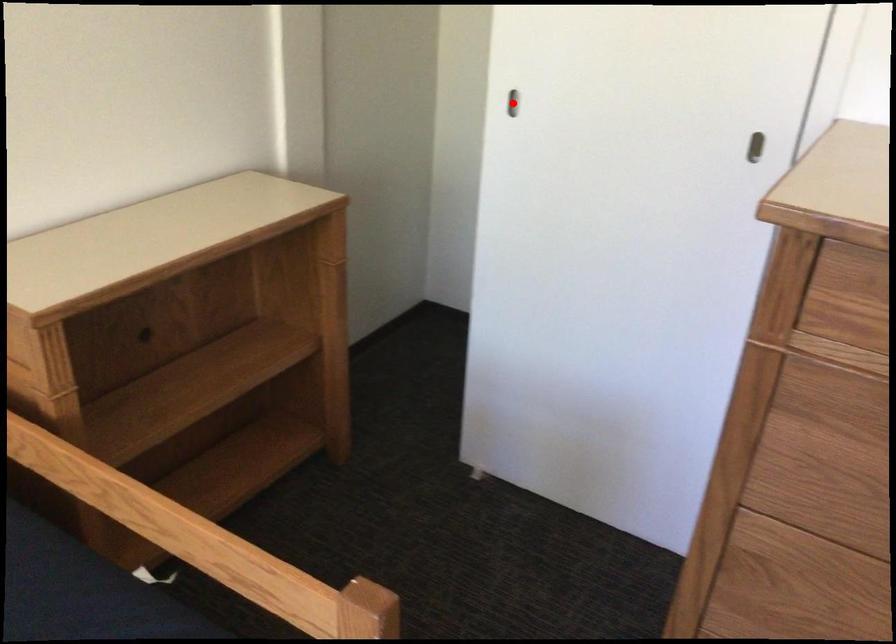
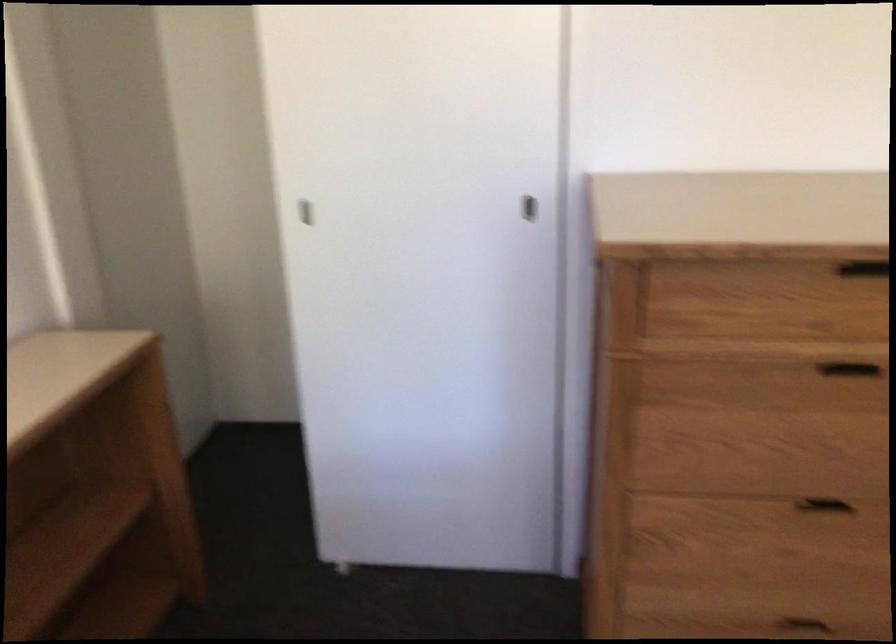
Find the pixel in the second image that matches the highlighted location in the first image.

(305, 212)